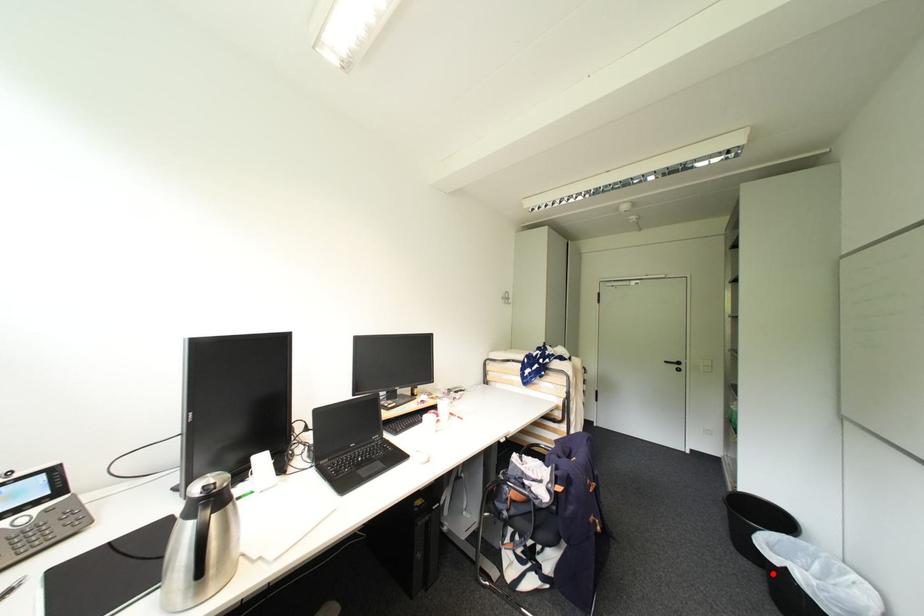
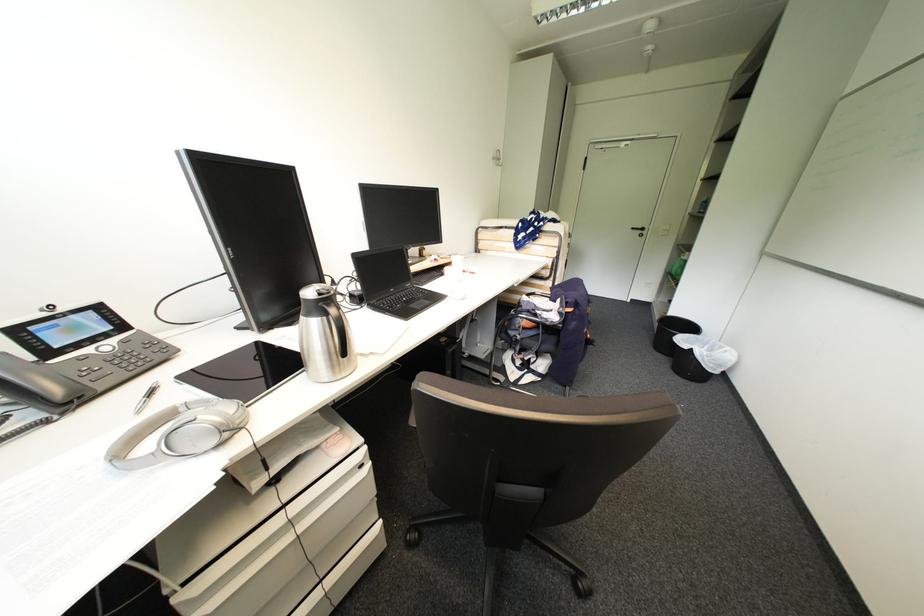
Question: I am providing you with two images of the same scene from different viewpoints. Given a red point in image1, look at the same physical point in image2. Is it:

Choices:
 (A) Closer to the viewpoint
 (B) Farther from the viewpoint

Answer: (A)